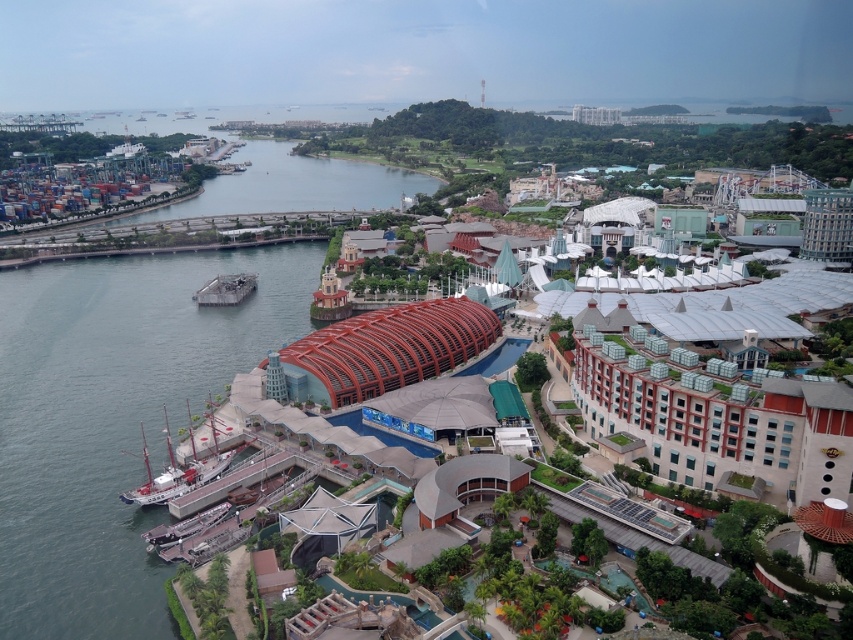
Can you confirm if gray concrete water at left is shorter than wooden ship at lower left?

Incorrect, gray concrete water at left's height does not fall short of wooden ship at lower left's.

Does gray concrete water at left come in front of wooden ship at lower left?

Yes.

The image size is (853, 640). In order to click on gray concrete water at left in this screenshot , I will do `click(113, 419)`.

Locate an element on the screen. gray concrete water at left is located at coordinates (113, 419).